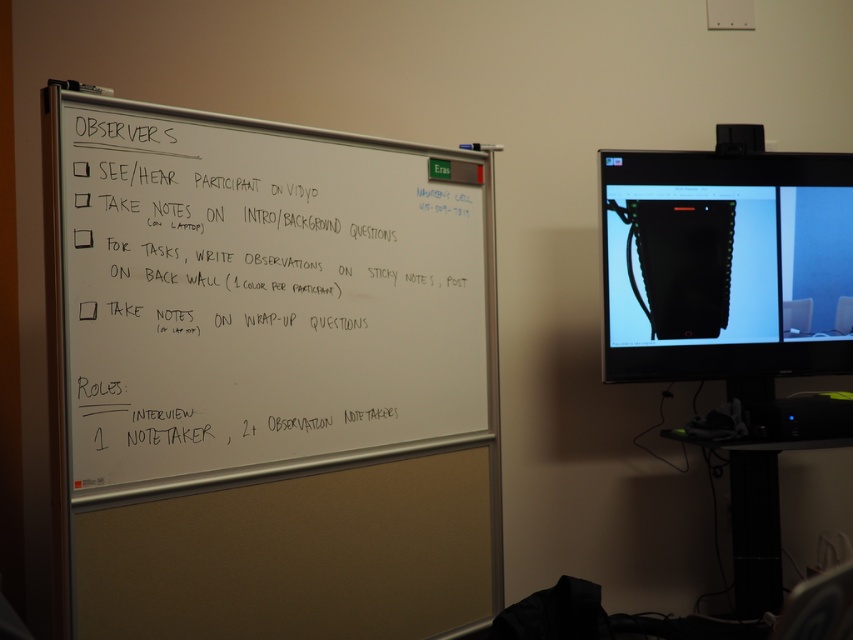
You are organizing a meeting in this room and need to place a large poster that requires the entire width of an object. Which object between the whiteboard at left and the matte black bag at upper right should you choose to ensure the poster fits?

The whiteboard at left has a greater width than the matte black bag at upper right, so you should choose the whiteboard at left to place the large poster that requires the entire width.

You are organizing a meeting in the classroom and need to place a new poster between the whiteboard at left and the matte black bag at upper right. Based on their positions, where should the poster be placed relative to these two objects?

The poster should be placed between the whiteboard at left and the matte black bag at upper right, positioned below the matte black bag at upper right and above the whiteboard at left since the whiteboard at left is located below the matte black bag at upper right.